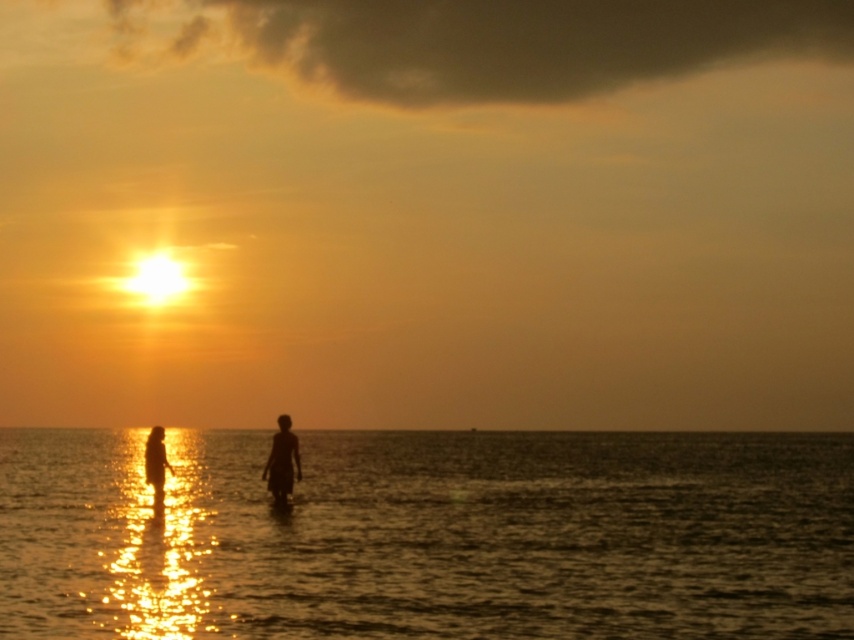
Question: Is silhouette figure at center to the right of silhouette figure at lower left from the viewer's perspective?

Choices:
 (A) yes
 (B) no

Answer: (A)

Question: Considering the real-world distances, which object is closest to the silhouette figure at center?

Choices:
 (A) silhouette figure at lower left
 (B) shiny reflective water at center

Answer: (A)

Question: Can you confirm if shiny reflective water at center is smaller than silhouette figure at center?

Choices:
 (A) no
 (B) yes

Answer: (A)

Question: Which point appears farthest from the camera in this image?

Choices:
 (A) (295, 435)
 (B) (161, 497)
 (C) (828, 465)

Answer: (C)

Question: Does shiny reflective water at center appear on the right side of silhouette figure at center?

Choices:
 (A) yes
 (B) no

Answer: (A)

Question: Which point is farther to the camera?

Choices:
 (A) silhouette figure at lower left
 (B) silhouette figure at center
 (C) shiny reflective water at center

Answer: (B)